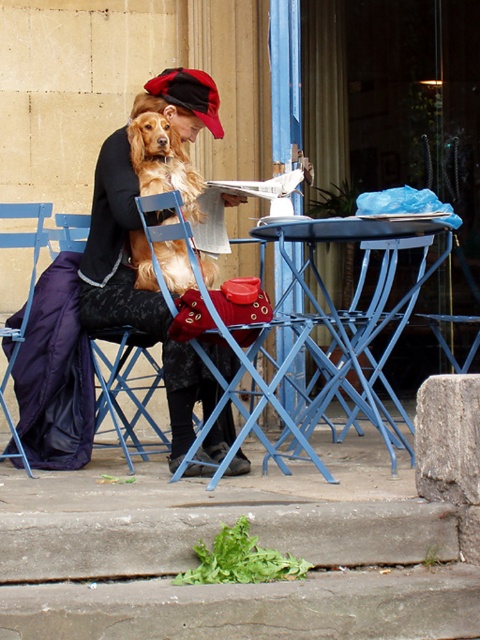
Is point (226, 413) in front of point (75, 243)?

Yes, it is in front of point (75, 243).

Is matte black coat at center shorter than blue metal chair at lower center?

Incorrect, matte black coat at center's height does not fall short of blue metal chair at lower center's.

Describe the element at coordinates (135, 291) in the screenshot. I see `matte black coat at center` at that location.

Locate an element on the screen. matte black coat at center is located at coordinates (135, 291).

Does blue metal table at center appear over blue metal chair at left?

No.

Is blue metal table at center positioned at the back of blue metal chair at left?

No, it is in front of blue metal chair at left.

Is point (334, 221) more distant than point (34, 250)?

No, it is not.

In order to click on blue metal table at center in this screenshot , I will do `click(355, 317)`.

Can you confirm if matte black coat at center is thinner than blue metal chair at left?

No.

Based on the photo, is matte black coat at center above blue metal chair at left?

Correct, matte black coat at center is located above blue metal chair at left.

Locate an element on the screen. The image size is (480, 640). matte black coat at center is located at coordinates (135, 291).